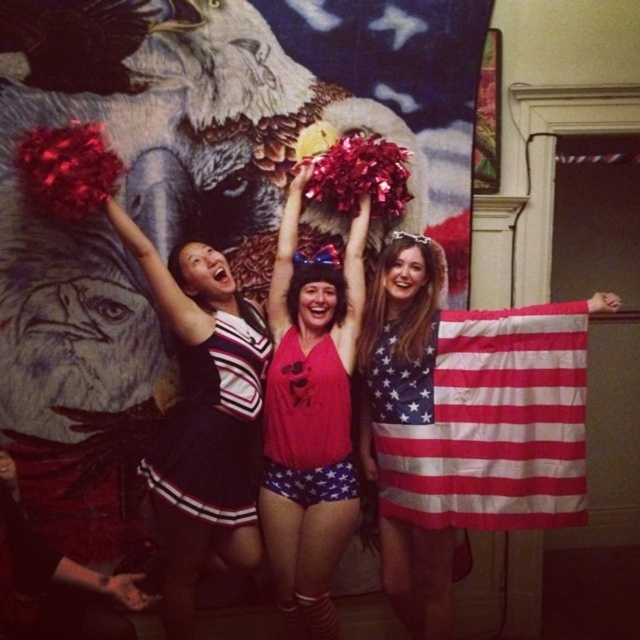
Does point (257, 308) come farther from viewer compared to point (324, 404)?

Yes.

Is black jersey at center shorter than red fabric dress at center?

Incorrect, black jersey at center's height does not fall short of red fabric dress at center's.

Is point (198, 458) less distant than point (291, 358)?

Yes.

The width and height of the screenshot is (640, 640). What are the coordinates of `black jersey at center` in the screenshot? It's located at (204, 419).

Looking at this image, is matte red halter top at center taller than velvet cheerleading outfit at center?

Yes, matte red halter top at center is taller than velvet cheerleading outfit at center.

Does matte red halter top at center have a lesser height compared to velvet cheerleading outfit at center?

In fact, matte red halter top at center may be taller than velvet cheerleading outfit at center.

Describe the element at coordinates (310, 416) in the screenshot. I see `matte red halter top at center` at that location.

This screenshot has height=640, width=640. I want to click on matte red halter top at center, so click(x=310, y=416).

Is black jersey at center positioned in front of velvet cheerleading outfit at center?

No, it is not.

Measure the distance between point [186,550] and camera.

Point [186,550] is 2.76 meters away from camera.

Does point (224, 339) lie in front of point (244, 497)?

That is True.

The height and width of the screenshot is (640, 640). I want to click on black jersey at center, so click(204, 419).